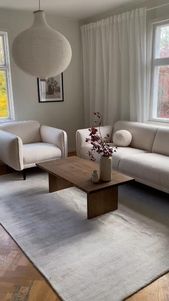
The width and height of the screenshot is (169, 301). I want to click on window curtain, so click(106, 57).